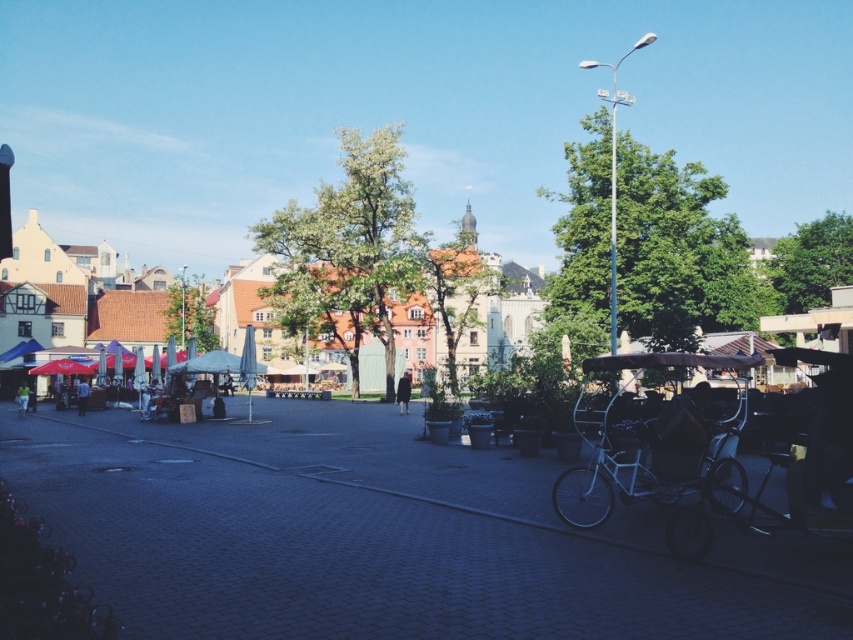
You are a tourist in this European town square and want to take a photo of the metallic silver rickshaw at right. However, you want to ensure that the blue fabric canopy at left isn

The metallic silver rickshaw at right is positioned under the blue fabric canopy at left, so taking a photo of the metallic silver rickshaw at right will automatically include the blue fabric canopy at left in the frame.

In the scene shown: You are standing at the center of the town square and see the point marked at coordinates (665, 449). What object is located at that point?

The point at coordinates (665, 449) indicates a metallic silver rickshaw at right.